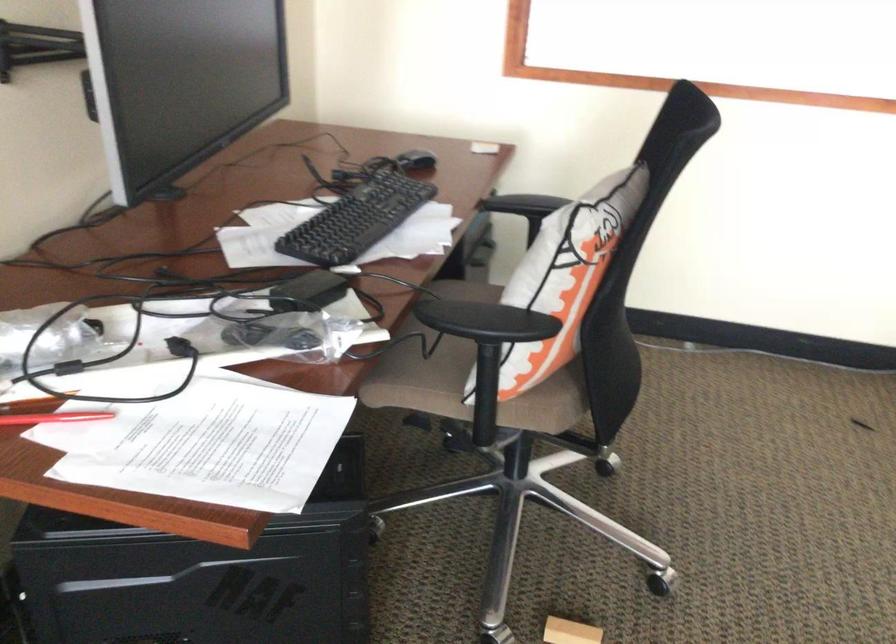
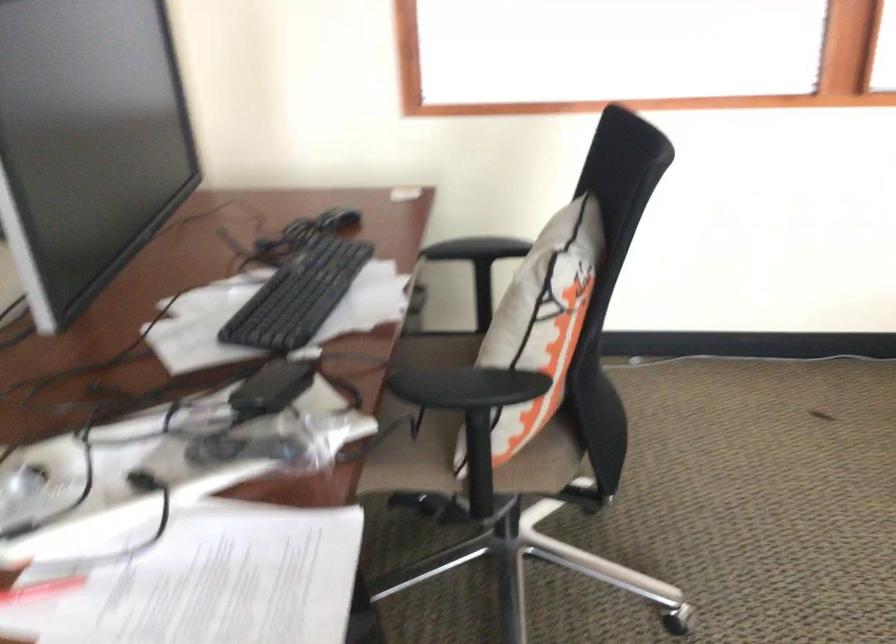
Question: The camera is either moving clockwise (left) or counter-clockwise (right) around the object. The first image is from the beginning of the video and the second image is from the end. Is the camera moving left or right when shooting the video?

Choices:
 (A) Left
 (B) Right

Answer: (A)